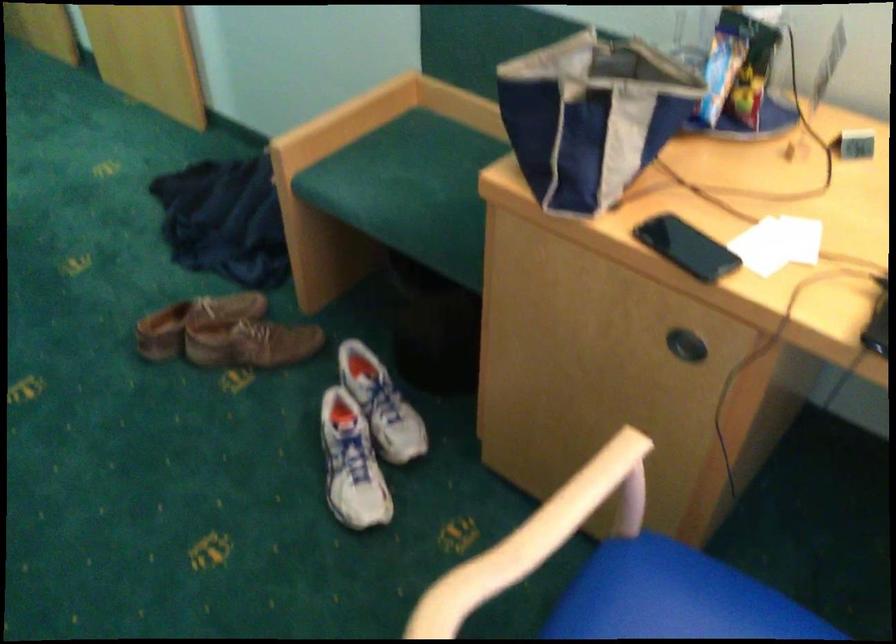
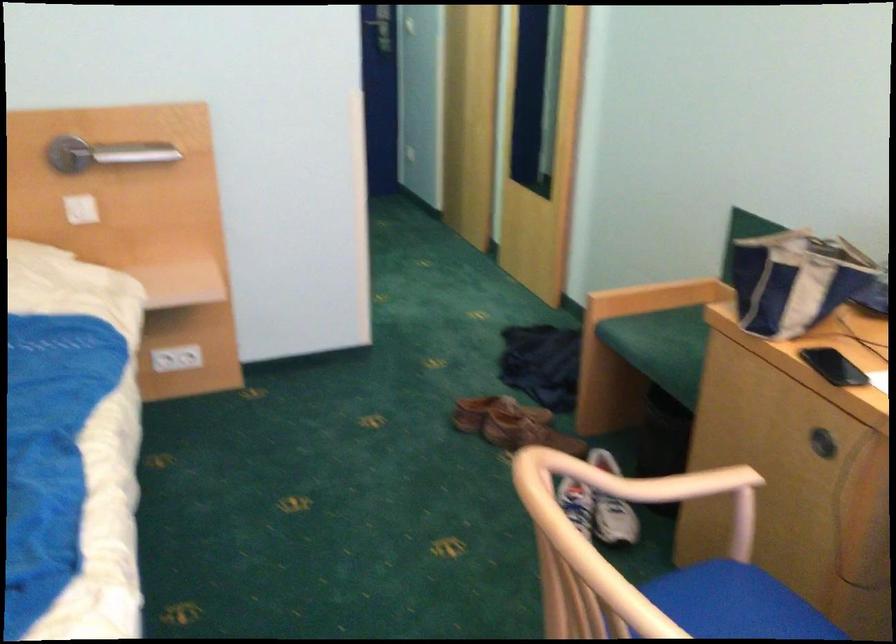
Locate, in the second image, the point that corresponds to (401,453) in the first image.

(609, 542)